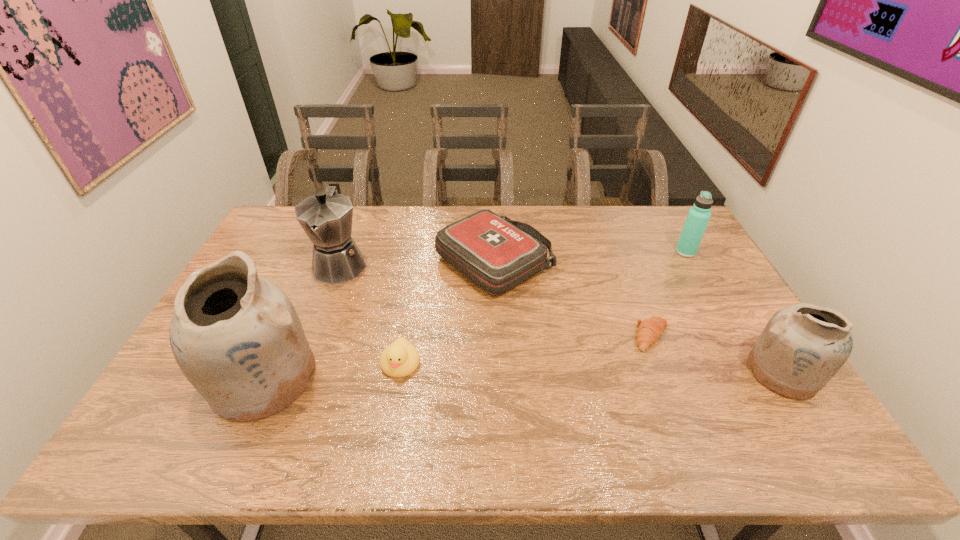
You are a GUI agent. You are given a task and a screenshot of the screen. Output one action in this format:
    pyautogui.click(x=<x>, y=<y>)
    Task: Click on the third object from left to right
    
    Given the screenshot: What is the action you would take?
    pyautogui.click(x=400, y=359)

What are the coordinates of `vacant position located on the right of the taller pottery` in the screenshot? It's located at (385, 378).

This screenshot has width=960, height=540. In order to click on free space located on the left of the shorter pottery in this screenshot , I will do `click(604, 372)`.

The height and width of the screenshot is (540, 960). Find the location of `free spot located 0.160m on the left of the thermos bottle`. free spot located 0.160m on the left of the thermos bottle is located at coordinates (630, 252).

Find the location of a particular element. The height and width of the screenshot is (540, 960). vacant space situated 0.180m on the left of the fifth tallest object is located at coordinates (381, 264).

Where is `vacant space located 0.350m on the left of the fifth object from left to right`? vacant space located 0.350m on the left of the fifth object from left to right is located at coordinates (507, 337).

At what (x,y) coordinates should I click in order to perform the action: click on blank space located at the spout of the second tallest object. Please return your answer as a coordinate pair (x, y). This screenshot has width=960, height=540. Looking at the image, I should click on click(314, 333).

Locate an element on the screen. vacant space located 0.060m on the face of the duckling is located at coordinates (394, 402).

The height and width of the screenshot is (540, 960). I want to click on the first-aid kit that is at the far edge, so click(496, 254).

This screenshot has width=960, height=540. What are the coordinates of `coffeepot that is at the far edge` in the screenshot? It's located at coord(326,217).